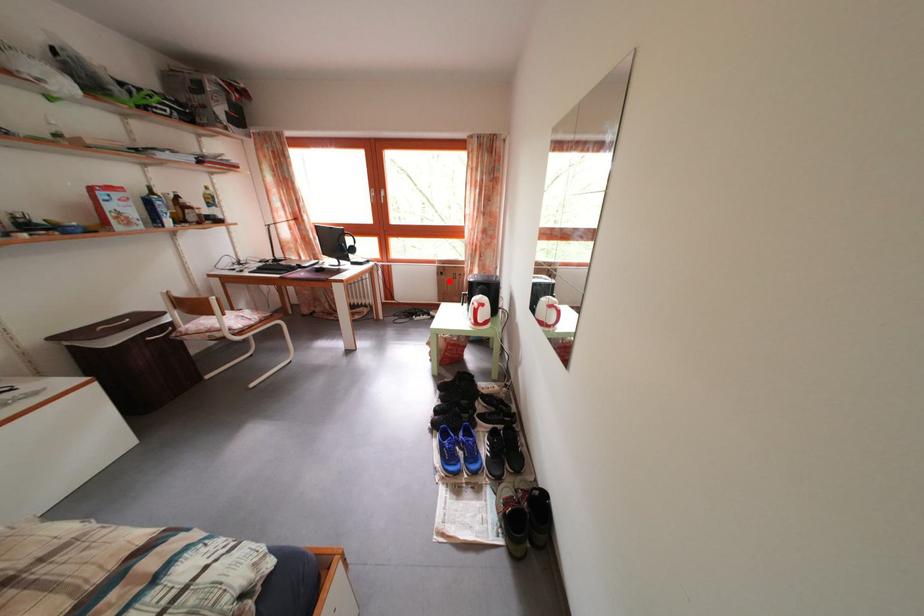
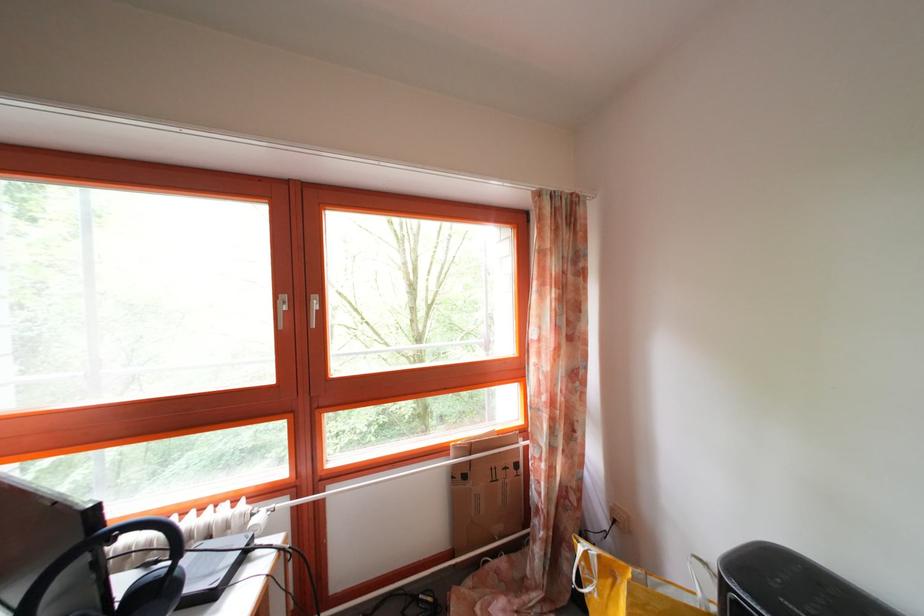
Find the pixel in the second image that matches the highlighted location in the first image.

(472, 484)